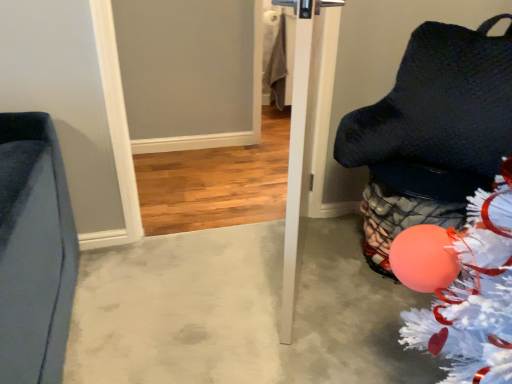
The width and height of the screenshot is (512, 384). Describe the element at coordinates (308, 132) in the screenshot. I see `white smooth door at center` at that location.

The width and height of the screenshot is (512, 384). Identify the location of white smooth door at center. (308, 132).

This screenshot has width=512, height=384. In order to click on white smooth door at center in this screenshot , I will do `click(308, 132)`.